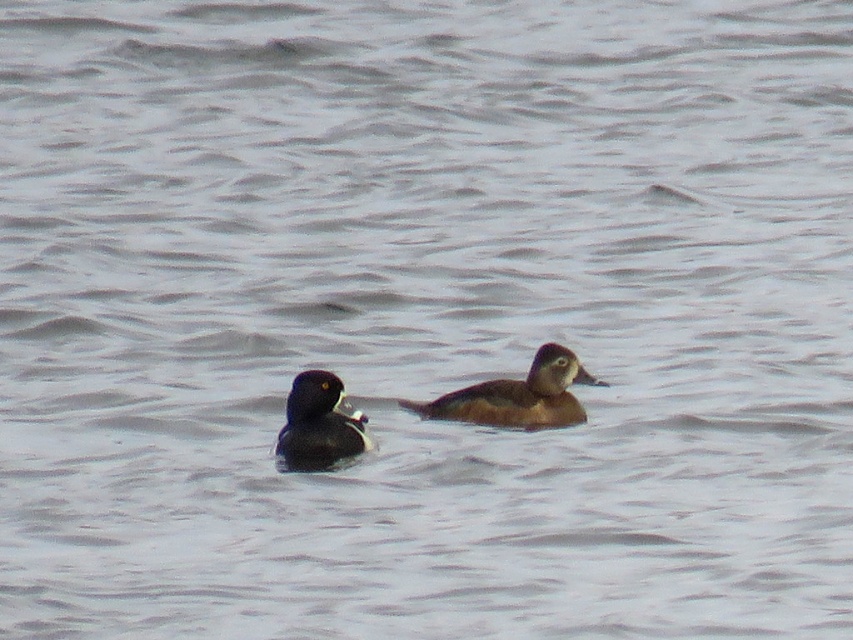
You are a wildlife photographer trying to capture both the brown fuzzy duck at center and the brown speckled duck at center in a single shot. Given that your camera has a fixed focal length, which duck should you position closer to the center of the frame to ensure both fit in the shot?

The brown fuzzy duck at center is wider than the brown speckled duck at center, so positioning the brown fuzzy duck at center closer to the center of the frame will help ensure both fit within the shot.

You are standing on a wooden dock observing two ducks in the water. You see the brown fuzzy duck at center and the brown speckled duck at center. Which duck is closer to you?

The brown fuzzy duck at center is closer to you because it is further to the viewer than the brown speckled duck at center.

You are a birdwatcher observing two ducks at the center of the image. You notice the brown fuzzy duck at center and the brown speckled duck at center. Which duck is shorter in height?

The brown fuzzy duck at center has a lesser height compared to the brown speckled duck at center, so the brown fuzzy duck at center is shorter.